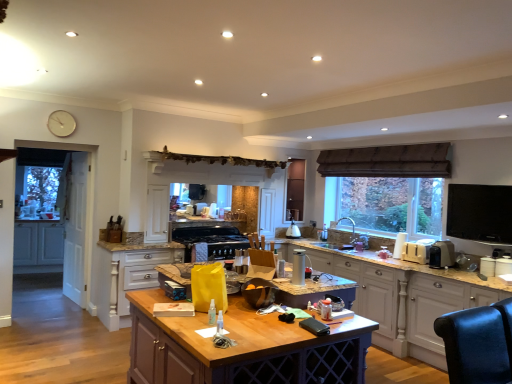
Find the location of a particular element. free space to the left of white plastic toaster at right, which is the third appliance from front to back is located at coordinates (397, 259).